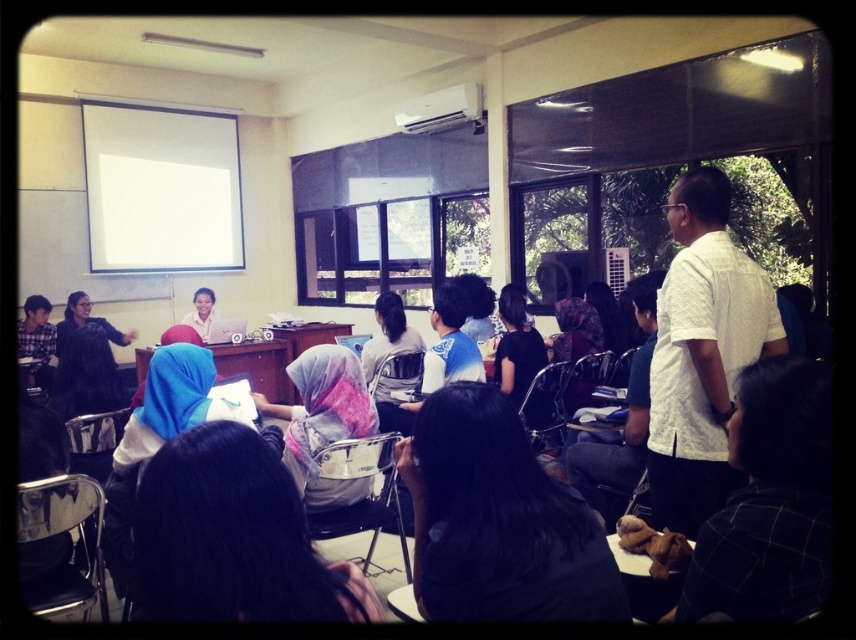
Is black fabric headscarf at center shorter than matte white shirt at center?

Correct, black fabric headscarf at center is not as tall as matte white shirt at center.

Locate an element on the screen. The image size is (856, 640). black fabric headscarf at center is located at coordinates (498, 520).

Describe the element at coordinates (498, 520) in the screenshot. I see `black fabric headscarf at center` at that location.

I want to click on black fabric headscarf at center, so click(498, 520).

This screenshot has height=640, width=856. Describe the element at coordinates (702, 353) in the screenshot. I see `white textured shirt at right` at that location.

Is point (691, 380) farther from camera compared to point (194, 298)?

No, (691, 380) is closer to viewer.

What do you see at coordinates (702, 353) in the screenshot? This screenshot has height=640, width=856. I see `white textured shirt at right` at bounding box center [702, 353].

Locate an element on the screen. white textured shirt at right is located at coordinates (702, 353).

Is point (490, 540) positioned behind point (704, 336)?

No.

Can you confirm if black fabric headscarf at center is positioned above white textured shirt at right?

Actually, black fabric headscarf at center is below white textured shirt at right.

What are the coordinates of `black fabric headscarf at center` in the screenshot? It's located at (498, 520).